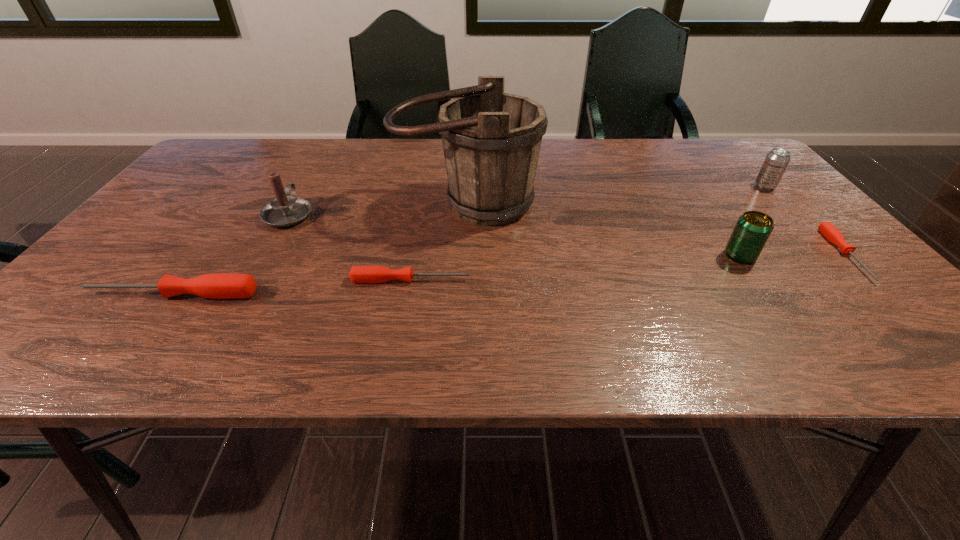
To ensure equal spacing by inserting another screwdriver among them, please point out a vacant spot for this new screwdriver. Please provide its 2D coordinates. Your answer should be formatted as a tuple, i.e. [(x, y)], where the tuple contains the x and y coordinates of a point satisfying the conditions above.

[(636, 267)]